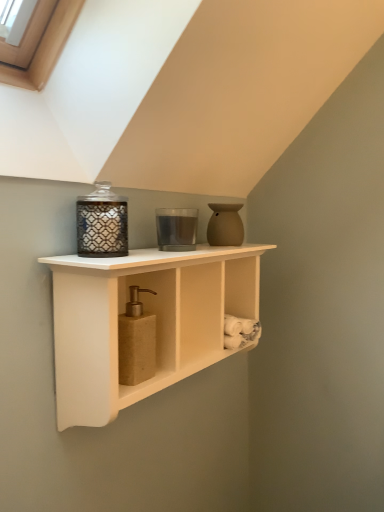
I want to click on matte beige vase at upper right, so click(225, 225).

Image resolution: width=384 pixels, height=512 pixels. What do you see at coordinates (102, 223) in the screenshot? I see `matte glass candle holder at upper left, the 1th candle holder in the left-to-right sequence` at bounding box center [102, 223].

Identify the location of matte beige vase at upper right. The image size is (384, 512). (225, 225).

Do you think matte beige vase at upper right is within white wood shelf at center, or outside of it?

matte beige vase at upper right is not inside white wood shelf at center, it's outside.

Is there a large distance between matte beige vase at upper right and white wood shelf at center?

That's not correct — matte beige vase at upper right is a little close to white wood shelf at center.

Considering the positions of objects matte beige vase at upper right and white wood shelf at center in the image provided, who is more to the left, matte beige vase at upper right or white wood shelf at center?

From the viewer's perspective, white wood shelf at center appears more on the left side.

This screenshot has width=384, height=512. I want to click on vase above the white wood shelf at center (from a real-world perspective), so click(x=225, y=225).

Who is shorter, white wood shelf at center or translucent glass candle at center, the first candle holder positioned from the right?

With less height is translucent glass candle at center, the first candle holder positioned from the right.

Can you confirm if white wood shelf at center is positioned to the right of translucent glass candle at center, acting as the first candle holder starting from the back?

Correct, you'll find white wood shelf at center to the right of translucent glass candle at center, acting as the first candle holder starting from the back.

Can you confirm if white wood shelf at center is thinner than translucent glass candle at center, marked as the second candle holder in a front-to-back arrangement?

No, white wood shelf at center is not thinner than translucent glass candle at center, marked as the second candle holder in a front-to-back arrangement.

From a real-world perspective, who is located lower, white wood shelf at center or translucent glass candle at center, marked as the second candle holder in a front-to-back arrangement?

From a 3D spatial view, white wood shelf at center is below.

From the image's perspective, relative to matte glass candle holder at upper left, which is the 1th candle holder from front to back, is matte beige vase at upper right above or below?

Based on their image positions, matte beige vase at upper right is located above matte glass candle holder at upper left, which is the 1th candle holder from front to back.

Between matte beige vase at upper right and matte glass candle holder at upper left, positioned as the 2th candle holder in right-to-left order, which one has smaller width?

With smaller width is matte beige vase at upper right.

Is matte glass candle holder at upper left, the second candle holder positioned from the back, at the back of matte beige vase at upper right?

No, matte beige vase at upper right is not facing the opposite direction of matte glass candle holder at upper left, the second candle holder positioned from the back.

Is matte glass candle holder at upper left, positioned as the 2th candle holder in right-to-left order, not within matte brown soap dispenser at center?

Yes, matte glass candle holder at upper left, positioned as the 2th candle holder in right-to-left order, is located beyond the bounds of matte brown soap dispenser at center.

From the image's perspective, between matte glass candle holder at upper left, the second candle holder positioned from the back, and matte brown soap dispenser at center, who is located below?

matte brown soap dispenser at center appears lower in the image.

Is matte glass candle holder at upper left, the 1th candle holder in the left-to-right sequence, next to matte brown soap dispenser at center and touching it?

No, matte glass candle holder at upper left, the 1th candle holder in the left-to-right sequence, is not with matte brown soap dispenser at center.

Considering the relative positions of matte glass candle holder at upper left, which is the 1th candle holder from front to back, and matte brown soap dispenser at center in the image provided, is matte glass candle holder at upper left, which is the 1th candle holder from front to back, behind matte brown soap dispenser at center?

No, it is in front of matte brown soap dispenser at center.

Considering the positions of point (235, 219) and point (124, 354), is point (235, 219) closer or farther from the camera than point (124, 354)?

Point (235, 219) is farther from the camera than point (124, 354).

From the image's perspective, who appears lower, matte beige vase at upper right or matte brown soap dispenser at center?

matte brown soap dispenser at center.

Would you say matte beige vase at upper right is to the left or to the right of matte brown soap dispenser at center in the picture?

matte beige vase at upper right is positioned on matte brown soap dispenser at center's right side.

How much distance is there between matte beige vase at upper right and matte brown soap dispenser at center?

matte beige vase at upper right and matte brown soap dispenser at center are 12.63 inches apart from each other.

Does matte brown soap dispenser at center come behind translucent glass candle at center, acting as the first candle holder starting from the back?

No, the depth of matte brown soap dispenser at center is less than that of translucent glass candle at center, acting as the first candle holder starting from the back.

From a real-world perspective, is matte brown soap dispenser at center physically above translucent glass candle at center, the first candle holder positioned from the right?

No, from a real-world perspective, matte brown soap dispenser at center is not on top of translucent glass candle at center, the first candle holder positioned from the right.

From the image's perspective, is matte brown soap dispenser at center located above or below translucent glass candle at center, marked as the second candle holder in a front-to-back arrangement?

Clearly, from the image's perspective, matte brown soap dispenser at center is below translucent glass candle at center, marked as the second candle holder in a front-to-back arrangement.

Considering the sizes of objects matte brown soap dispenser at center and translucent glass candle at center, acting as the first candle holder starting from the back, in the image provided, who is shorter, matte brown soap dispenser at center or translucent glass candle at center, acting as the first candle holder starting from the back,?

Answer: Standing shorter between the two is translucent glass candle at center, acting as the first candle holder starting from the back.

Does matte brown soap dispenser at center turn towards matte beige vase at upper right?

No, matte brown soap dispenser at center does not turn towards matte beige vase at upper right.

Which object is thinner, matte brown soap dispenser at center or matte beige vase at upper right?

matte brown soap dispenser at center.

From the image's perspective, who appears lower, matte brown soap dispenser at center or matte beige vase at upper right?

matte brown soap dispenser at center.

From a real-world perspective, is matte brown soap dispenser at center on matte beige vase at upper right?

Incorrect, from a real-world perspective, matte brown soap dispenser at center is lower than matte beige vase at upper right.

You are a GUI agent. You are given a task and a screenshot of the screen. Output one action in this format:
    pyautogui.click(x=<x>, y=<y>)
    Task: Click on the vase on the right of white wood shelf at center
    The height and width of the screenshot is (512, 384).
    Given the screenshot: What is the action you would take?
    coord(225,225)

At what (x,y) coordinates should I click in order to perform the action: click on the 2nd candle holder located above the white wood shelf at center (from a real-world perspective). Please return your answer as a coordinate pair (x, y). The width and height of the screenshot is (384, 512). Looking at the image, I should click on (176, 229).

Considering their positions, is matte glass candle holder at upper left, which is the 1th candle holder from front to back, positioned further to translucent glass candle at center, which appears as the second candle holder when viewed from the left, than matte beige vase at upper right?

matte glass candle holder at upper left, which is the 1th candle holder from front to back, is further to translucent glass candle at center, which appears as the second candle holder when viewed from the left.

When comparing their distances from matte beige vase at upper right, does translucent glass candle at center, the first candle holder positioned from the right, or white wood shelf at center seem further?

Based on the image, white wood shelf at center appears to be further to matte beige vase at upper right.

Which object lies further to the anchor point matte brown soap dispenser at center, white wood shelf at center or matte beige vase at upper right?

matte beige vase at upper right is further to matte brown soap dispenser at center.

From the image, which object appears to be nearer to matte glass candle holder at upper left, the second candle holder positioned from the back, matte beige vase at upper right or matte brown soap dispenser at center?

matte brown soap dispenser at center is closer to matte glass candle holder at upper left, the second candle holder positioned from the back.

Based on their spatial positions, is white wood shelf at center or translucent glass candle at center, acting as the first candle holder starting from the back, closer to matte brown soap dispenser at center?

Among the two, white wood shelf at center is located nearer to matte brown soap dispenser at center.

From the picture: Estimate the real-world distances between objects in this image. Which object is closer to white wood shelf at center, translucent glass candle at center, the first candle holder positioned from the right, or matte glass candle holder at upper left, the second candle holder positioned from the back?

Based on the image, matte glass candle holder at upper left, the second candle holder positioned from the back, appears to be nearer to white wood shelf at center.

Based on their spatial positions, is matte brown soap dispenser at center or matte glass candle holder at upper left, the 1th candle holder in the left-to-right sequence, closer to white wood shelf at center?

matte brown soap dispenser at center is positioned closer to the anchor white wood shelf at center.

Estimate the real-world distances between objects in this image. Which object is further from matte glass candle holder at upper left, which is the 1th candle holder from front to back, matte brown soap dispenser at center or translucent glass candle at center, which appears as the second candle holder when viewed from the left?

translucent glass candle at center, which appears as the second candle holder when viewed from the left, lies further to matte glass candle holder at upper left, which is the 1th candle holder from front to back, than the other object.

Locate an element on the screen. Image resolution: width=384 pixels, height=512 pixels. soap dispenser between matte glass candle holder at upper left, which is the 1th candle holder from front to back, and matte beige vase at upper right in the front-back direction is located at coordinates (136, 341).

Image resolution: width=384 pixels, height=512 pixels. Identify the location of candle holder between translucent glass candle at center, the first candle holder positioned from the right, and matte brown soap dispenser at center from top to bottom. (102, 223).

The image size is (384, 512). Find the location of `soap dispenser between matte glass candle holder at upper left, positioned as the 2th candle holder in right-to-left order, and white wood shelf at center vertically`. soap dispenser between matte glass candle holder at upper left, positioned as the 2th candle holder in right-to-left order, and white wood shelf at center vertically is located at coordinates (136, 341).

The height and width of the screenshot is (512, 384). Identify the location of candle holder positioned between matte glass candle holder at upper left, the 1th candle holder in the left-to-right sequence, and matte beige vase at upper right from near to far. (176, 229).